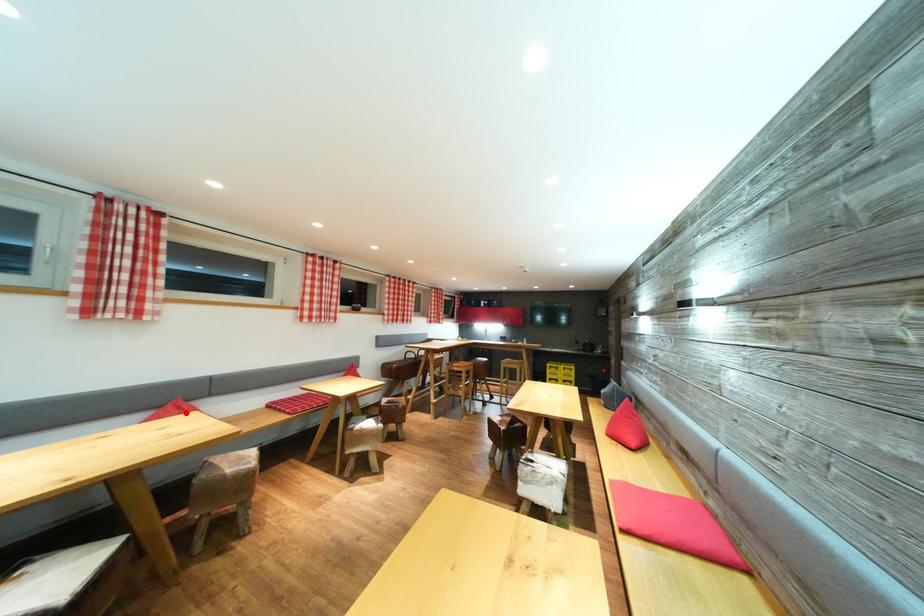
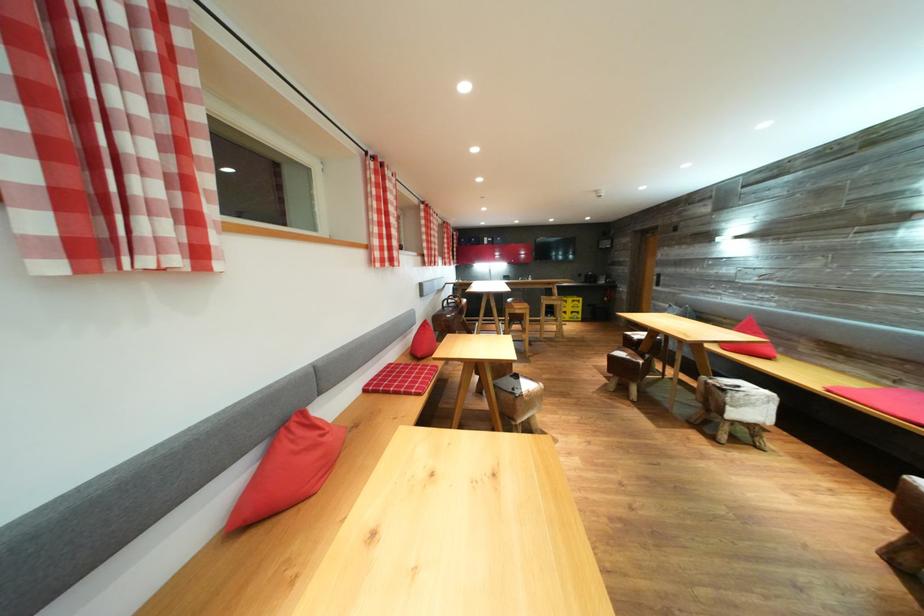
In the second image, find the point that corresponds to the highlighted location in the first image.

(320, 431)